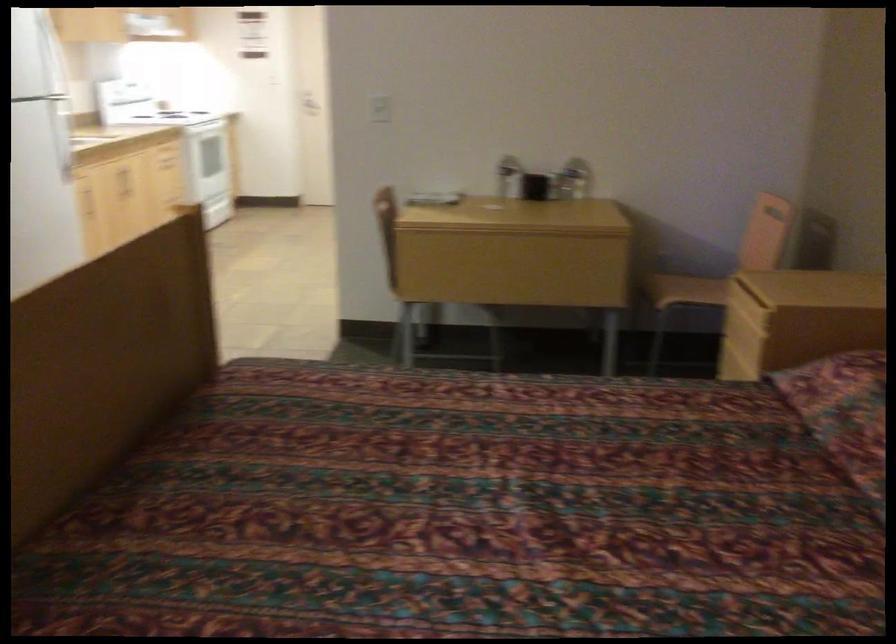
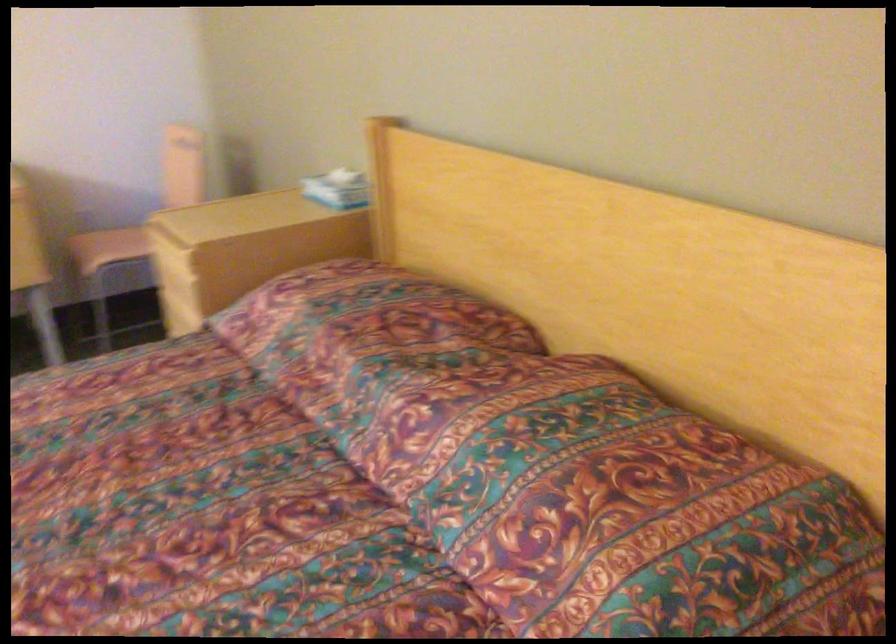
Where in the second image is the point corresponding to (x=679, y=289) from the first image?

(108, 247)